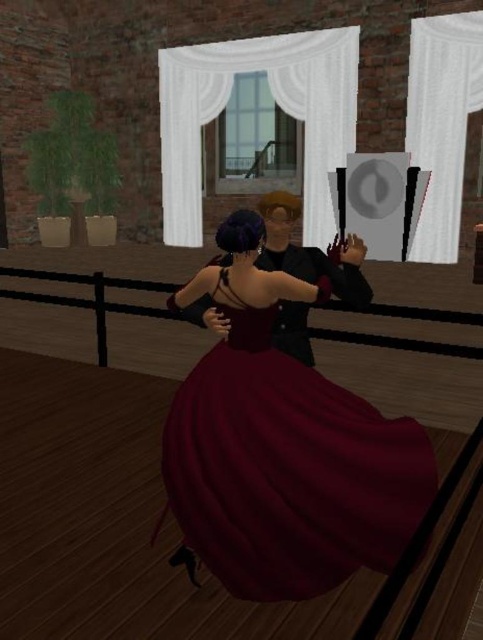
You are standing in the room and want to place a decorative vase exactly at point (241, 513). The vase is 1.5 meters tall. Is the ceiling height sufficient to accommodate the vase at that point?

The distance of point (241, 513) from camera is 2.15 meters. Since the vase is only 1.5 meters tall, the ceiling height at that point is sufficient to accommodate the vase.

You are a photographer positioned at the entrance of the room. You want to capture a photo that clearly shows both the burgundy satin dress at center and the shiny black suit at center. Which character should you focus on to ensure both are in sharp focus?

You should focus on the shiny black suit at center because the burgundy satin dress at center is in front of it, so focusing on the background subject may not keep both in sharp focus. Alternatively, focus between them or use a smaller aperture for deeper depth of field.